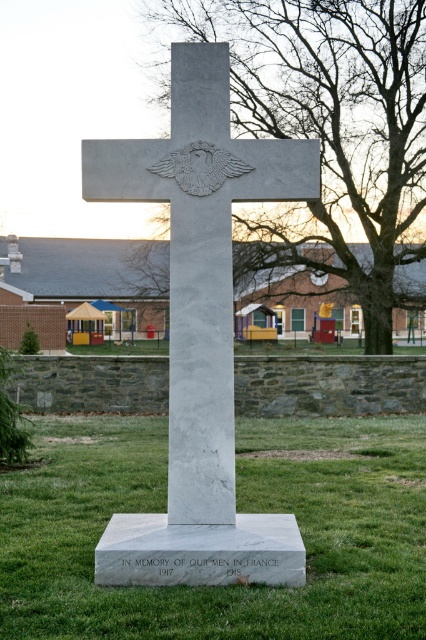
Does point (131, 621) lie behind point (296, 534)?

No, (131, 621) is in front of (296, 534).

Is point (43, 451) positioned before point (287, 580)?

No, (43, 451) is further to viewer.

You are a GUI agent. You are given a task and a screenshot of the screen. Output one action in this format:
    pyautogui.click(x=<x>, y=<y>)
    Task: Click on the green grass at center
    
    Given the screenshot: What is the action you would take?
    pyautogui.click(x=238, y=509)